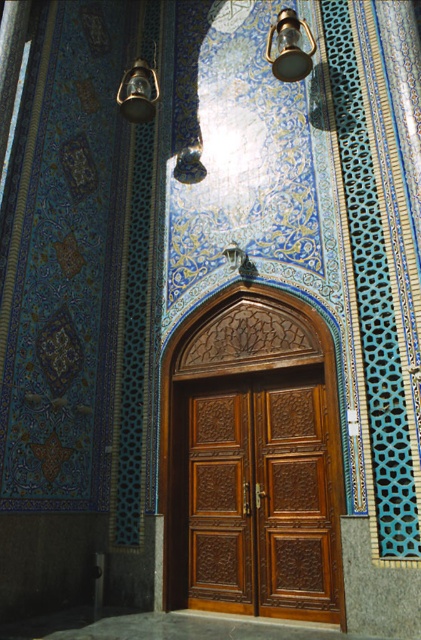
You are standing in front of the entrance and want to locate the brown carved wood door at center and the metallic brass lantern at upper left. Based on their positions, which object is closer to the left side of the entrance?

The metallic brass lantern at upper left is closer to the left side of the entrance because the brown carved wood door at center is to the right of it.

You are standing in front of the entrance and want to take a photo of the brown carved wood door at center. According to the scene description, where should you position your camera to capture the door at its central point?

To capture the brown carved wood door at center at its central point, position your camera at the 2D coordinates specified by the point (261, 496).

You are standing in front of the ornate entrance and want to take a photo of the brown carved wood door at center. If your camera can focus on objects up to 5 meters away, will it be able to capture the door clearly?

The brown carved wood door at center is 5.02 meters from camera, which is slightly beyond the camera focus limit of 5 meters. Therefore, the camera may not focus properly on the door.